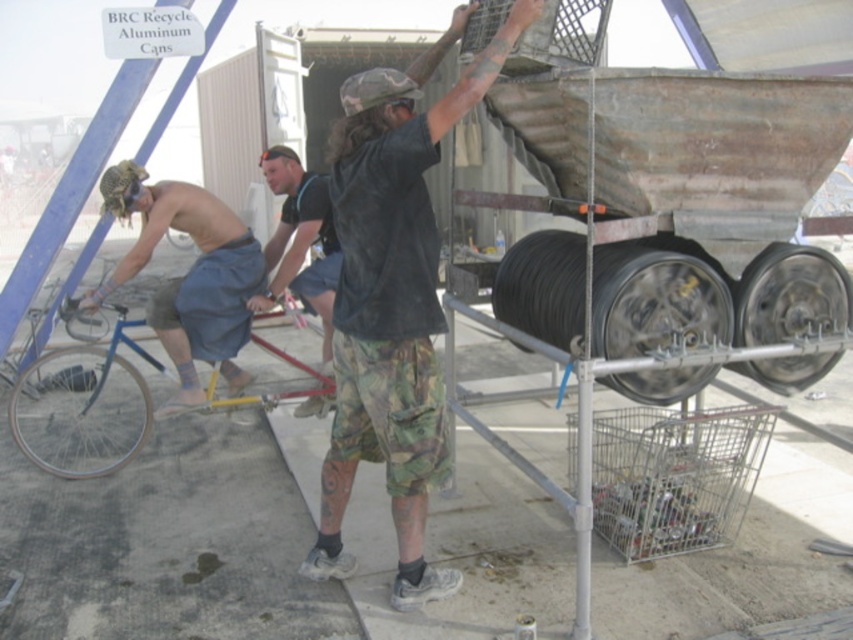
Looking at this image, you are standing in the BRC Recycle Aluminum Cans area and see the black rubber tire at right and the black rubber wheel at right. Which one is located more to the right side?

The black rubber tire at right is positioned more to the right side than the black rubber wheel at right.

You are standing in the BRC Recycle Aluminum Cans area and see a blue matte bicycle at left and a black cotton shirt at center. Which object is positioned more to the left side?

The blue matte bicycle at left is positioned more to the left side than the black cotton shirt at center.